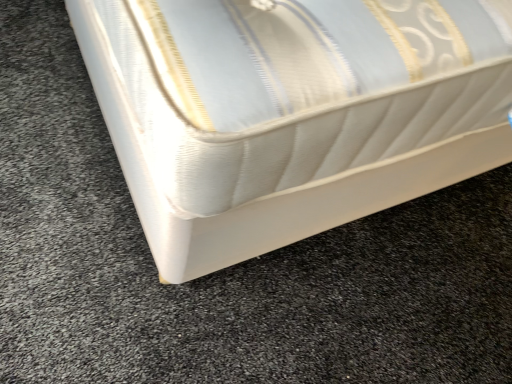
I want to click on white textured mattress at center, so click(x=291, y=113).

What do you see at coordinates (291, 113) in the screenshot? I see `white textured mattress at center` at bounding box center [291, 113].

Identify the location of white textured mattress at center. Image resolution: width=512 pixels, height=384 pixels. (291, 113).